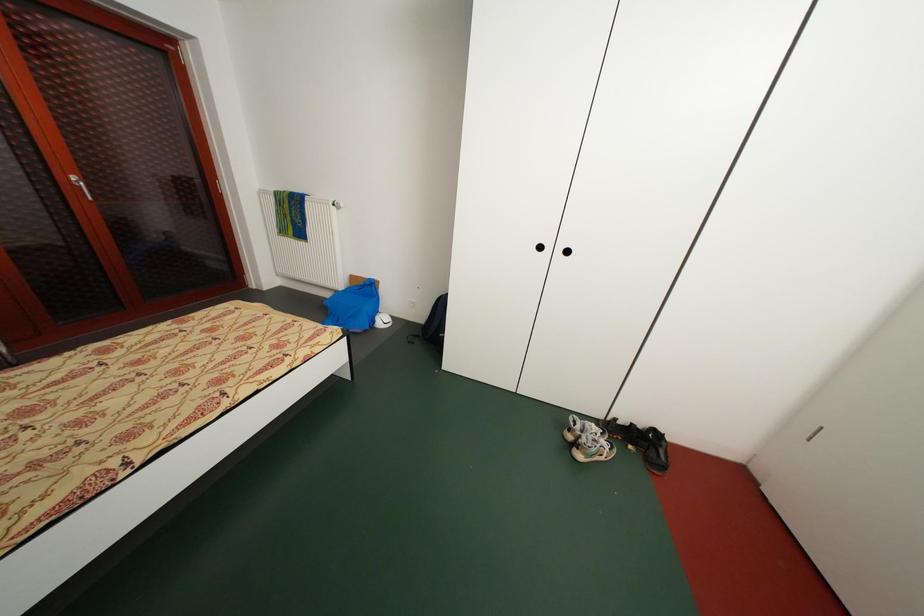
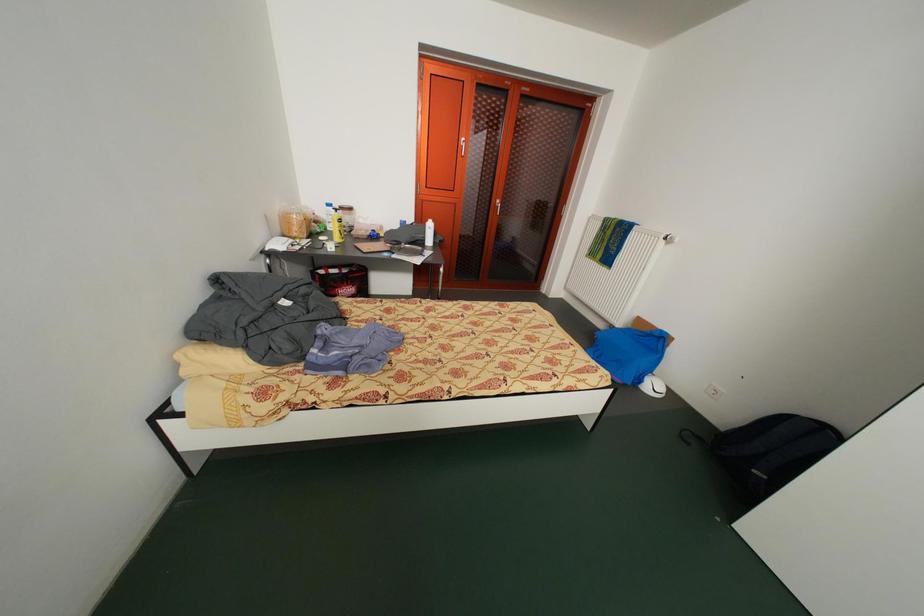
Question: The camera is either moving clockwise (left) or counter-clockwise (right) around the object. The first image is from the beginning of the video and the second image is from the end. Is the camera moving left or right when shooting the video?

Choices:
 (A) Left
 (B) Right

Answer: (B)